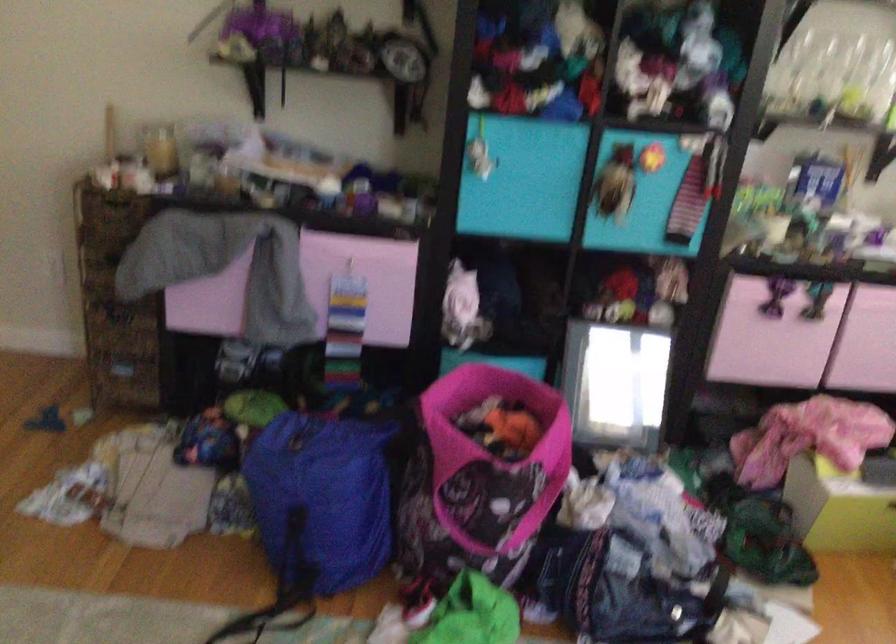
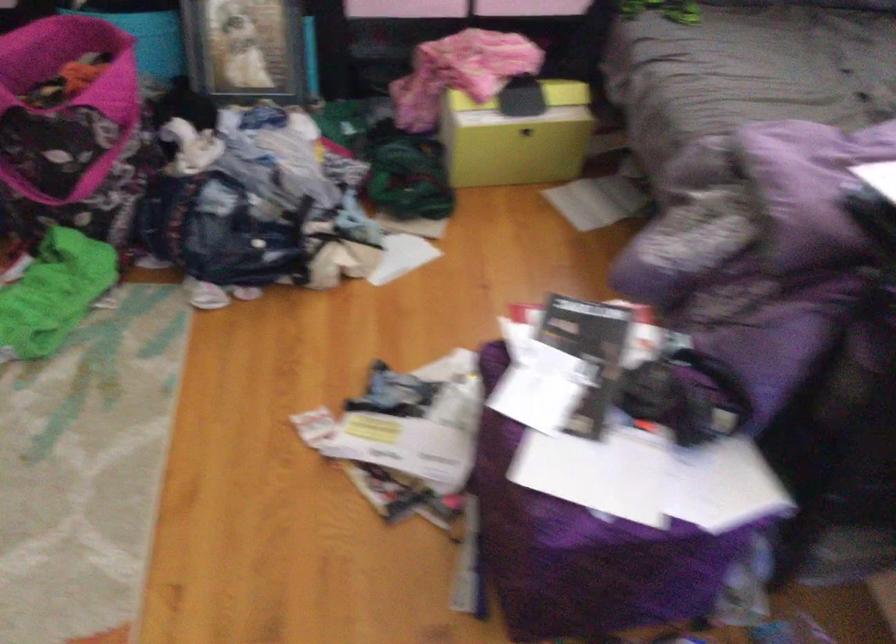
Question: The images are taken continuously from a first-person perspective. In which direction is your viewpoint rotating?

Choices:
 (A) Left
 (B) Right
 (C) Up
 (D) Down

Answer: (D)